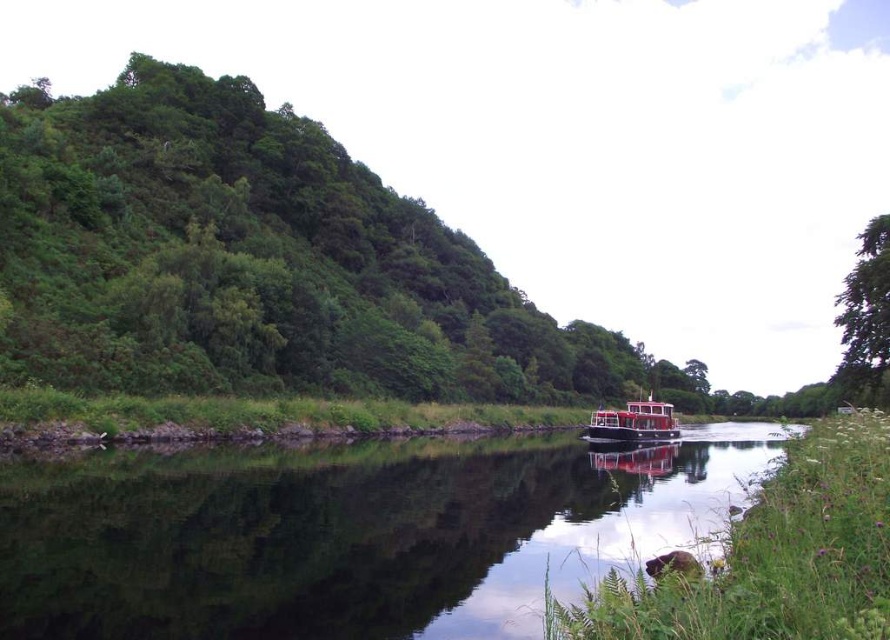
Question: Is green leafy hillside at left thinner than green leafy tree at upper right?

Choices:
 (A) yes
 (B) no

Answer: (B)

Question: Does green leafy hillside at left have a greater width compared to green leafy tree at upper right?

Choices:
 (A) yes
 (B) no

Answer: (A)

Question: Can you confirm if clear glass water at center is positioned below red matte boat at center?

Choices:
 (A) yes
 (B) no

Answer: (B)

Question: Based on their relative distances, which object is farther from the red matte boat at center?

Choices:
 (A) green leafy hillside at left
 (B) clear glass water at center
 (C) green leafy tree at upper right

Answer: (A)

Question: Which object appears farthest from the camera in this image?

Choices:
 (A) green leafy tree at upper right
 (B) green leafy hillside at left

Answer: (B)

Question: Based on their relative distances, which object is farther from the green leafy hillside at left?

Choices:
 (A) red matte boat at center
 (B) clear glass water at center
 (C) green leafy tree at upper right

Answer: (C)